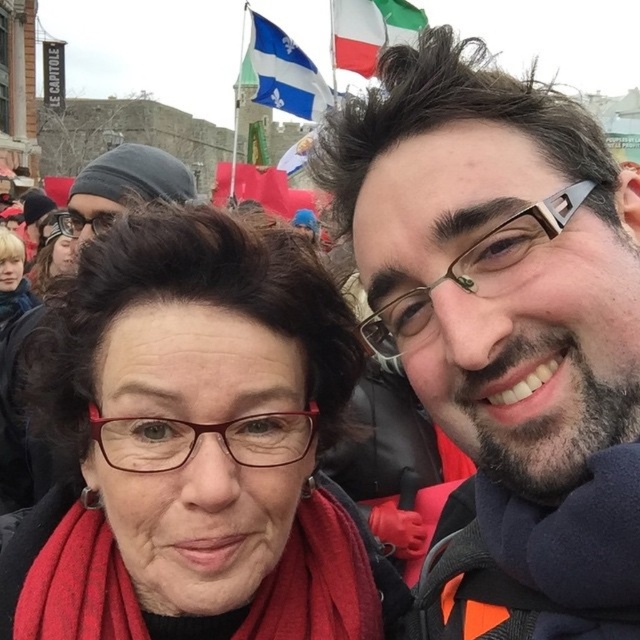
Can you confirm if red woolen scarf at lower left is thinner than white fabric flag at upper center?

No.

Does red woolen scarf at lower left have a larger size compared to white fabric flag at upper center?

Incorrect, red woolen scarf at lower left is not larger than white fabric flag at upper center.

The width and height of the screenshot is (640, 640). Find the location of `red woolen scarf at lower left`. red woolen scarf at lower left is located at coordinates (317, 580).

At what (x,y) coordinates should I click in order to perform the action: click on red woolen scarf at lower left. Please return your answer as a coordinate pair (x, y). Looking at the image, I should click on (317, 580).

Can you confirm if matte red scarf at center is taller than red woolen scarf at lower left?

Yes, matte red scarf at center is taller than red woolen scarf at lower left.

What do you see at coordinates (195, 445) in the screenshot? The width and height of the screenshot is (640, 640). I see `matte red scarf at center` at bounding box center [195, 445].

This screenshot has height=640, width=640. In order to click on matte red scarf at center in this screenshot , I will do `click(195, 445)`.

What are the coordinates of `matte red scarf at center` in the screenshot? It's located at (195, 445).

Is point (276, 316) farther from camera compared to point (268, 44)?

That is False.

What are the coordinates of `matte red scarf at center` in the screenshot? It's located at pyautogui.click(x=195, y=445).